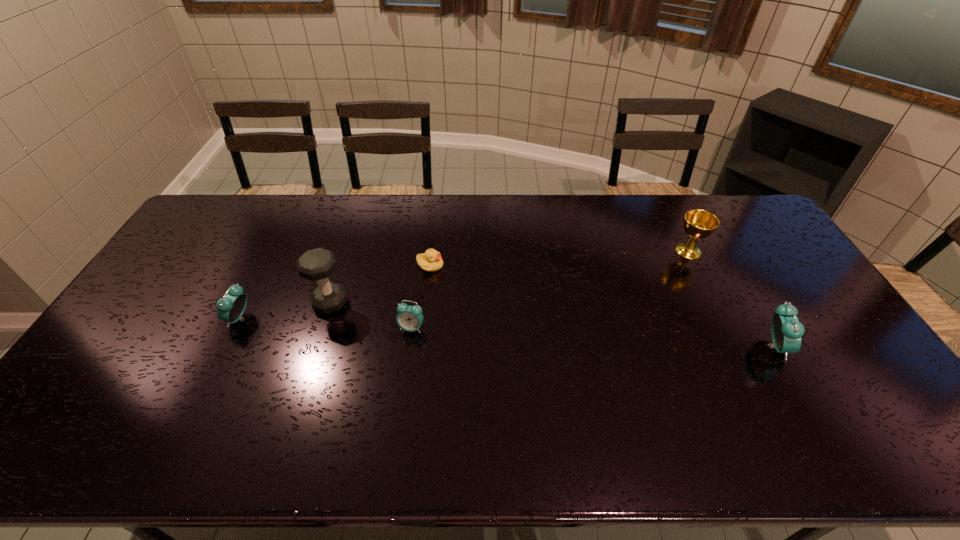
This screenshot has height=540, width=960. I want to click on vacant space in between the second alarm clock from left to right and the second tallest alarm clock, so click(326, 323).

Locate an element on the screen. free space between the rightmost object and the leftmost object is located at coordinates (507, 333).

Where is `object that stands as the second closest to the fifth object from left to right`? The width and height of the screenshot is (960, 540). object that stands as the second closest to the fifth object from left to right is located at coordinates (431, 261).

Identify which object is the fifth closest to the chalice. Please provide its 2D coordinates. Your answer should be formatted as a tuple, i.e. [(x, y)], where the tuple contains the x and y coordinates of a point satisfying the conditions above.

[(231, 307)]

Image resolution: width=960 pixels, height=540 pixels. I want to click on alarm clock that stands as the second closest to the shortest alarm clock, so click(787, 331).

I want to click on alarm clock that is the second closest to the second tallest alarm clock, so click(787, 331).

Where is `vacant space that satisfies the following two spatial constraints: 1. on the front side of the chalice; 2. on the face of the leftmost object`? vacant space that satisfies the following two spatial constraints: 1. on the front side of the chalice; 2. on the face of the leftmost object is located at coordinates (722, 319).